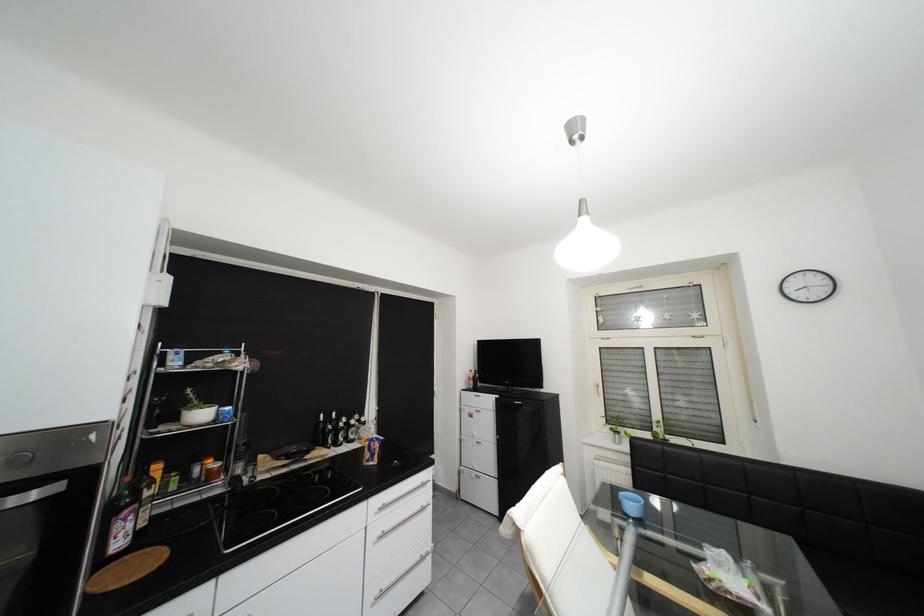
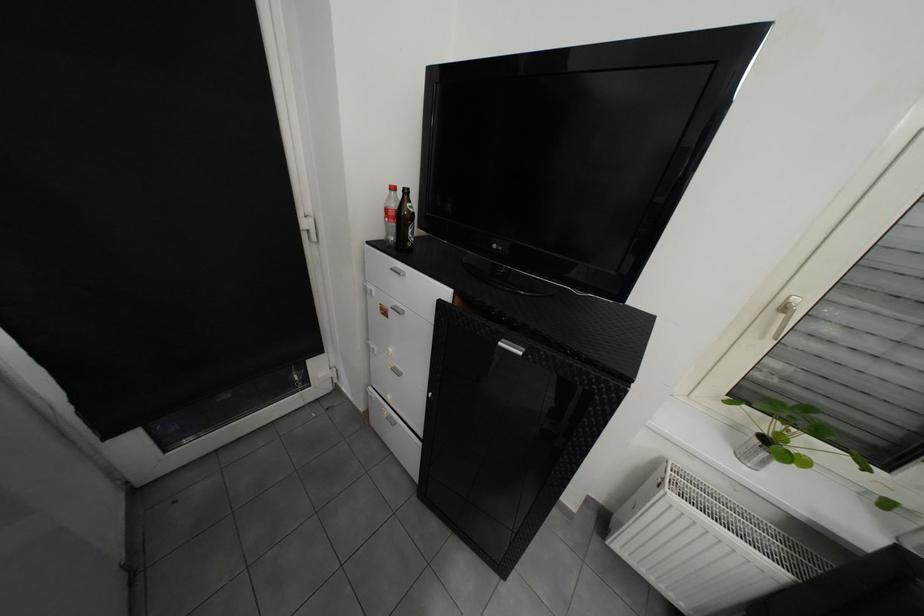
Find the pixel in the second image that matches point 626,444 in the first image.

(754, 458)